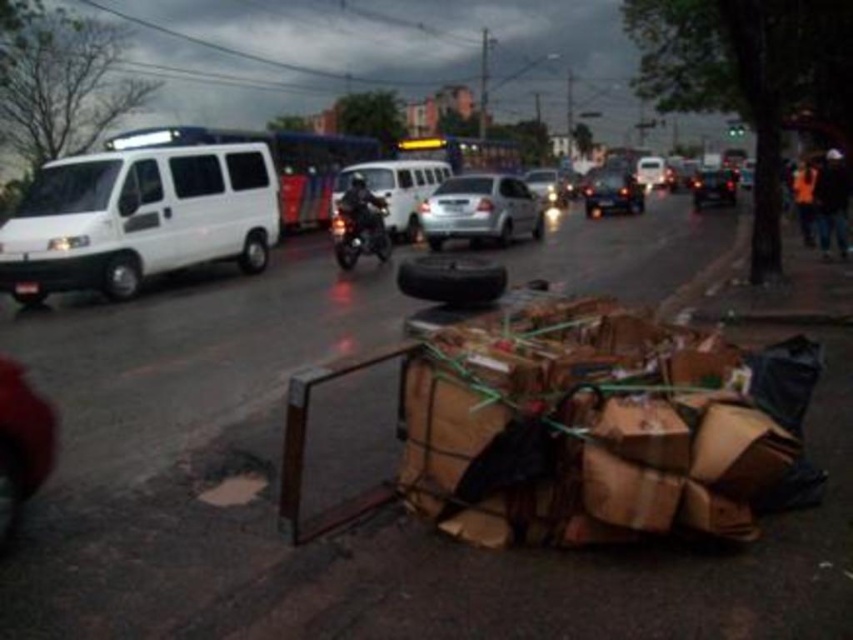
The height and width of the screenshot is (640, 853). What do you see at coordinates (358, 228) in the screenshot?
I see `shiny metallic motorcycle at center` at bounding box center [358, 228].

Does point (378, 253) lie in front of point (718, 189)?

Yes, it is.

This screenshot has height=640, width=853. I want to click on shiny metallic motorcycle at center, so click(358, 228).

Does silver metallic car at center have a greater height compared to white matte van at center?

Incorrect, silver metallic car at center's height is not larger of white matte van at center's.

Does point (450, 196) come behind point (368, 170)?

No, it is not.

Which is behind, point (445, 232) or point (401, 173)?

Positioned behind is point (401, 173).

Find the location of a particular element. The width and height of the screenshot is (853, 640). silver metallic car at center is located at coordinates (480, 211).

The image size is (853, 640). Identify the location of shiny metallic motorcycle at center. (358, 228).

Can you confirm if shiny metallic motorcycle at center is positioned to the right of dark matte motorcycle at center?

Incorrect, shiny metallic motorcycle at center is not on the right side of dark matte motorcycle at center.

What do you see at coordinates (358, 228) in the screenshot?
I see `shiny metallic motorcycle at center` at bounding box center [358, 228].

You are a GUI agent. You are given a task and a screenshot of the screen. Output one action in this format:
    pyautogui.click(x=<x>, y=<y>)
    Task: Click on the shiny metallic motorcycle at center
    The height and width of the screenshot is (640, 853).
    Given the screenshot: What is the action you would take?
    tap(358, 228)